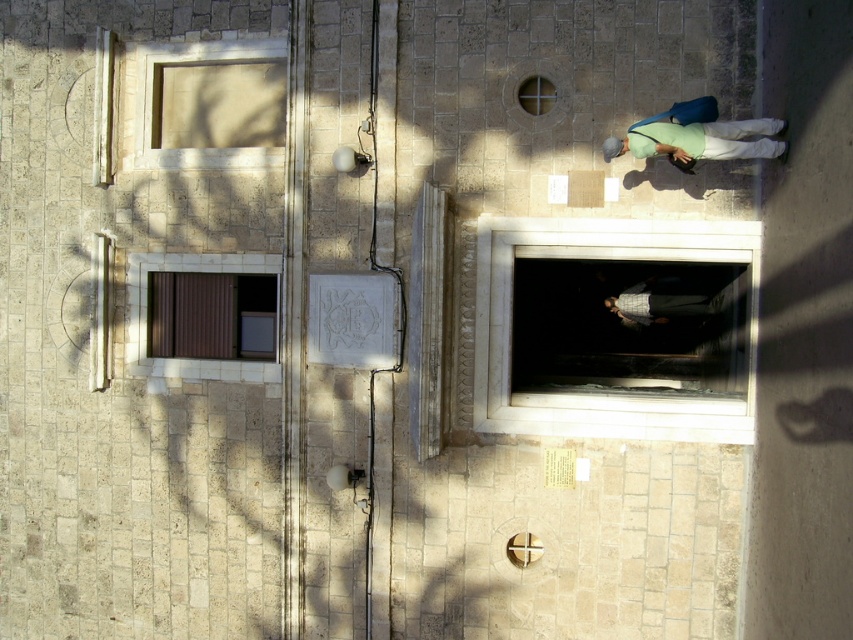
Is the position of brown matte window at upper left more distant than that of green fabric at center?

Yes, brown matte window at upper left is behind green fabric at center.

The image size is (853, 640). I want to click on brown matte window at upper left, so click(x=212, y=316).

The width and height of the screenshot is (853, 640). Identify the location of white marble window at center. click(x=604, y=390).

Is beige stone window at upper left further to camera compared to plaid fabric shirt at center?

That is False.

Is beige stone window at upper left in front of plaid fabric shirt at center?

That is True.

At what (x,y) coordinates should I click in order to perform the action: click on beige stone window at upper left. Please return your answer as a coordinate pair (x, y). Image resolution: width=853 pixels, height=640 pixels. Looking at the image, I should click on (210, 104).